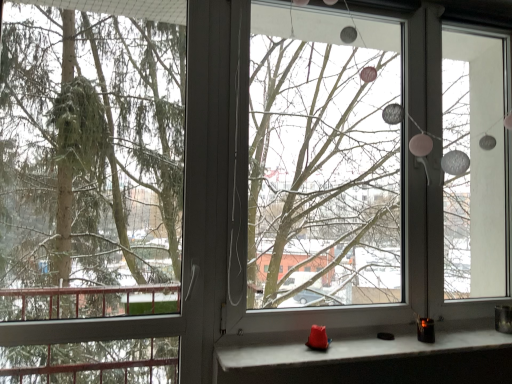
Question: Is green matte tree at left not close to transparent glass window screen at center?

Choices:
 (A) no
 (B) yes

Answer: (B)

Question: From the image's perspective, is green matte tree at left below transparent glass window screen at center?

Choices:
 (A) yes
 (B) no

Answer: (A)

Question: Is green matte tree at left positioned with its back to transparent glass window screen at center?

Choices:
 (A) no
 (B) yes

Answer: (A)

Question: From a real-world perspective, does green matte tree at left stand above transparent glass window screen at center?

Choices:
 (A) yes
 (B) no

Answer: (B)

Question: From the image's perspective, is green matte tree at left over transparent glass window screen at center?

Choices:
 (A) yes
 (B) no

Answer: (B)

Question: Considering the relative sizes of green matte tree at left and transparent glass window screen at center in the image provided, is green matte tree at left taller than transparent glass window screen at center?

Choices:
 (A) yes
 (B) no

Answer: (B)

Question: Is matte white stone at lower center located outside transparent glass window screen at center?

Choices:
 (A) yes
 (B) no

Answer: (A)

Question: Can you confirm if matte white stone at lower center is thinner than transparent glass window screen at center?

Choices:
 (A) no
 (B) yes

Answer: (A)

Question: From the image's perspective, would you say matte white stone at lower center is shown under transparent glass window screen at center?

Choices:
 (A) yes
 (B) no

Answer: (A)

Question: Is matte white stone at lower center shorter than transparent glass window screen at center?

Choices:
 (A) yes
 (B) no

Answer: (A)

Question: Can you see matte white stone at lower center touching transparent glass window screen at center?

Choices:
 (A) yes
 (B) no

Answer: (B)

Question: Can you confirm if matte white stone at lower center is wider than transparent glass window screen at center?

Choices:
 (A) no
 (B) yes

Answer: (B)

Question: Can you confirm if matte white stone at lower center is shorter than green matte tree at left?

Choices:
 (A) yes
 (B) no

Answer: (A)